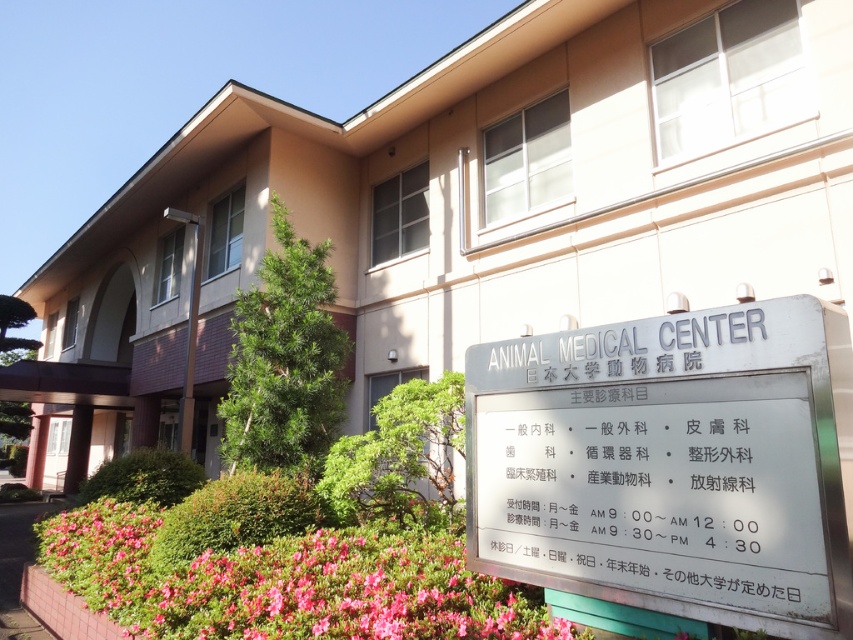
Question: Which of the following is the farthest from the observer?

Choices:
 (A) (532, 525)
 (B) (422, 602)

Answer: (A)

Question: Is metallic signboard at center further to camera compared to pink matte flowers at lower left?

Choices:
 (A) no
 (B) yes

Answer: (A)

Question: Which point is closer to the camera?

Choices:
 (A) (688, 372)
 (B) (682, 458)
 (C) (196, 564)

Answer: (B)

Question: Where is silver metallic sign at center located in relation to metallic signboard at center in the image?

Choices:
 (A) left
 (B) right

Answer: (B)

Question: Estimate the real-world distances between objects in this image. Which object is farther from the pink matte flowers at lower left?

Choices:
 (A) silver metallic sign at center
 (B) metallic signboard at center

Answer: (A)

Question: Can you confirm if silver metallic sign at center is thinner than metallic signboard at center?

Choices:
 (A) no
 (B) yes

Answer: (A)